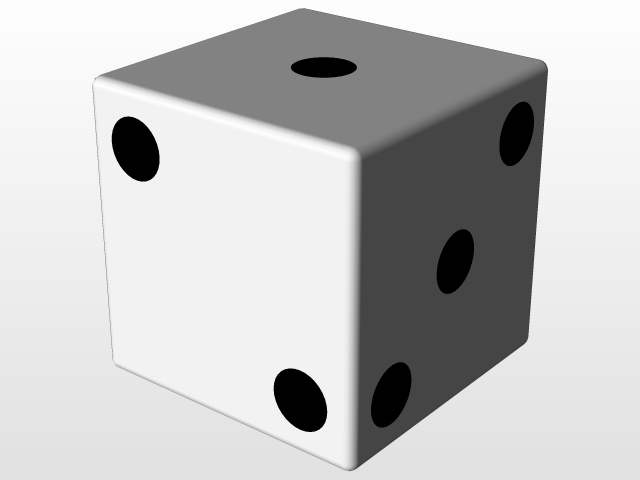
Where is `corners`? corners is located at coordinates (93, 78), (301, 7), (547, 64), (356, 152), (349, 466), (525, 338), (112, 361).